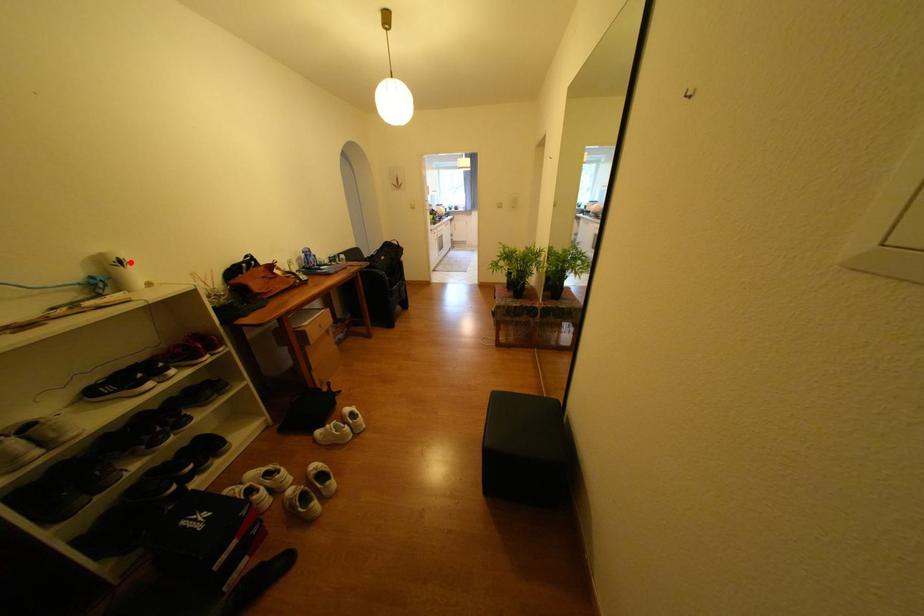
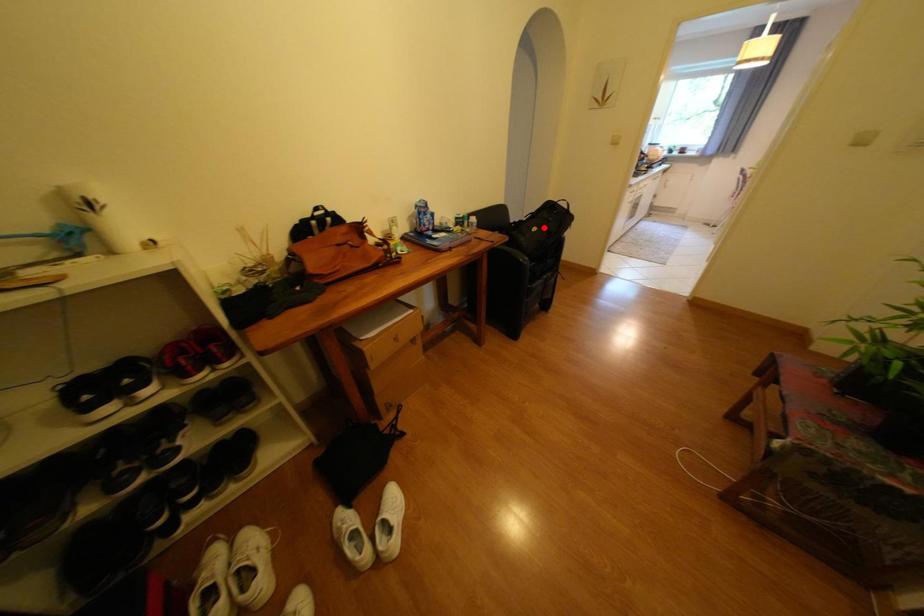
I am providing you with two images of the same scene from different viewpoints. A red point is marked on the first image and another point is marked on the second image. Is the marked point in image1 the same physical position as the marked point in image2?

No